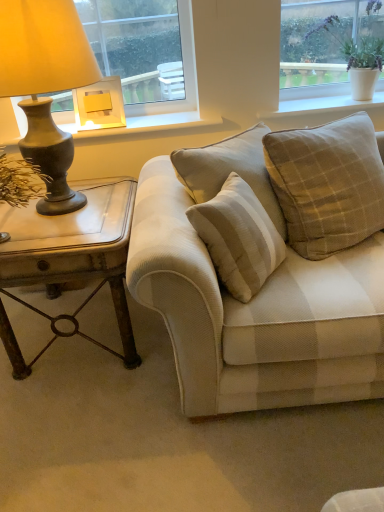
Question: From a real-world perspective, is beige checkered pillow at upper right, the first pillow when ordered from right to left, over beige textured couch at center?

Choices:
 (A) no
 (B) yes

Answer: (B)

Question: Is beige checkered pillow at upper right, which ranks as the second pillow in left-to-right order, oriented towards beige textured couch at center?

Choices:
 (A) no
 (B) yes

Answer: (B)

Question: Considering the relative sizes of beige checkered pillow at upper right, the first pillow when ordered from right to left, and beige textured couch at center in the image provided, is beige checkered pillow at upper right, the first pillow when ordered from right to left, shorter than beige textured couch at center?

Choices:
 (A) no
 (B) yes

Answer: (B)

Question: From a real-world perspective, does beige checkered pillow at upper right, the first pillow when ordered from right to left, sit lower than beige textured couch at center?

Choices:
 (A) no
 (B) yes

Answer: (A)

Question: Is beige checkered pillow at upper right, the first pillow when ordered from right to left, outside of beige textured couch at center?

Choices:
 (A) no
 (B) yes

Answer: (A)

Question: Is beige checkered pillow at upper right, which ranks as the second pillow in left-to-right order, turned away from beige textured couch at center?

Choices:
 (A) no
 (B) yes

Answer: (B)

Question: Is matte bronze lamp at left, positioned as the 2th lamp in back-to-front order, positioned beyond the bounds of beige textured pillow at center, placed as the 2th pillow when sorted from right to left?

Choices:
 (A) no
 (B) yes

Answer: (B)

Question: Can you confirm if matte bronze lamp at left, marked as the 1th lamp in a front-to-back arrangement, is thinner than beige textured pillow at center, the 1th pillow viewed from the left?

Choices:
 (A) yes
 (B) no

Answer: (B)

Question: From the image's perspective, is matte bronze lamp at left, positioned as the 2th lamp in back-to-front order, over beige textured pillow at center, placed as the 2th pillow when sorted from right to left?

Choices:
 (A) no
 (B) yes

Answer: (B)

Question: Is matte bronze lamp at left, positioned as the 2th lamp in back-to-front order, taller than beige textured pillow at center, the 1th pillow viewed from the left?

Choices:
 (A) yes
 (B) no

Answer: (A)

Question: Can you confirm if matte bronze lamp at left, marked as the 1th lamp in a front-to-back arrangement, is positioned to the right of beige textured pillow at center, the 1th pillow viewed from the left?

Choices:
 (A) yes
 (B) no

Answer: (B)

Question: Considering the relative sizes of matte bronze lamp at left, positioned as the 2th lamp in back-to-front order, and beige textured pillow at center, the 1th pillow viewed from the left, in the image provided, is matte bronze lamp at left, positioned as the 2th lamp in back-to-front order, bigger than beige textured pillow at center, the 1th pillow viewed from the left,?

Choices:
 (A) no
 (B) yes

Answer: (B)

Question: Is white ceramic pot at upper right, positioned as the 2th window in left-to-right order, positioned far away from matte wood window sill at upper center?

Choices:
 (A) no
 (B) yes

Answer: (A)